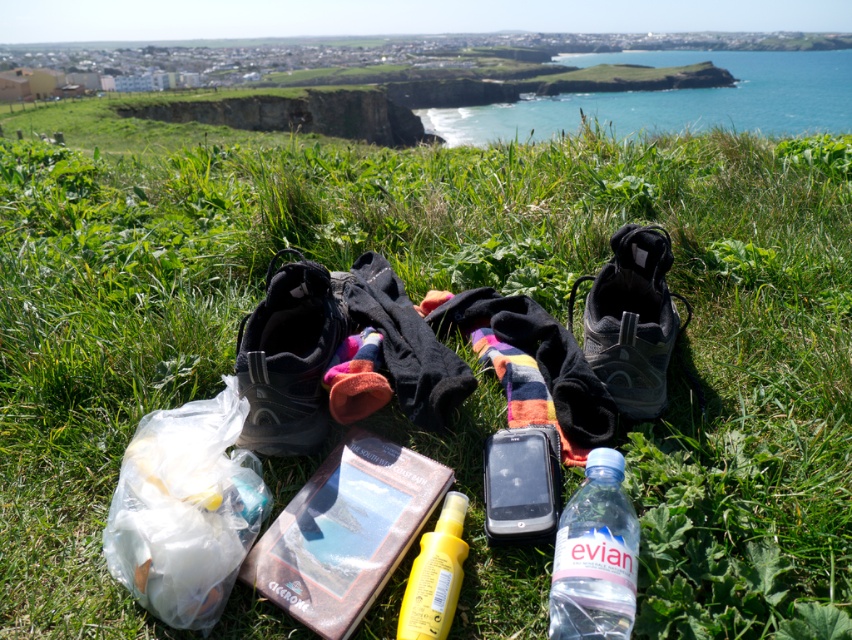
Question: Is translucent plastic bag at center above green grassy cliff at center?

Choices:
 (A) yes
 (B) no

Answer: (B)

Question: Which point is closer to the camera taking this photo?

Choices:
 (A) (849, 120)
 (B) (304, 349)
 (C) (348, 115)

Answer: (B)

Question: Which point is farther to the camera?

Choices:
 (A) translucent plastic bag at center
 (B) clear plastic bottle at center
 (C) matte black shoe at center
 (D) yellow matte bottle at center

Answer: (C)

Question: Which object is farther from the camera taking this photo?

Choices:
 (A) green grassy cliff at center
 (B) clear plastic bottle at center
 (C) yellow matte bottle at center
 (D) blue water at upper center

Answer: (A)

Question: Is black mesh shoe at center smaller than green grassy cliff at center?

Choices:
 (A) no
 (B) yes

Answer: (B)

Question: Does clear plastic bottle at center have a lesser width compared to green grassy cliff at center?

Choices:
 (A) no
 (B) yes

Answer: (B)